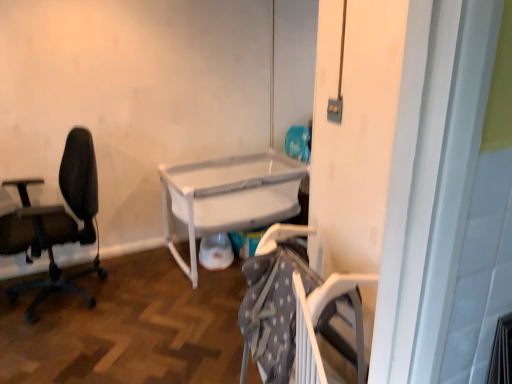
Question: Is white plastic crib at center at the back of black mesh office chair at left?

Choices:
 (A) no
 (B) yes

Answer: (B)

Question: From the image's perspective, would you say black mesh office chair at left is positioned over white plastic crib at center?

Choices:
 (A) no
 (B) yes

Answer: (A)

Question: Is black mesh office chair at left smaller than white plastic crib at center?

Choices:
 (A) no
 (B) yes

Answer: (B)

Question: Considering the relative positions of black mesh office chair at left and white plastic crib at center in the image provided, is black mesh office chair at left behind white plastic crib at center?

Choices:
 (A) yes
 (B) no

Answer: (B)

Question: Is black mesh office chair at left positioned far away from white plastic crib at center?

Choices:
 (A) yes
 (B) no

Answer: (B)

Question: In terms of width, does white plastic screen door at center look wider or thinner when compared to black mesh office chair at left?

Choices:
 (A) wide
 (B) thin

Answer: (B)

Question: Would you say white plastic screen door at center is inside or outside black mesh office chair at left?

Choices:
 (A) inside
 (B) outside

Answer: (B)

Question: From the image's perspective, is white plastic screen door at center above or below black mesh office chair at left?

Choices:
 (A) below
 (B) above

Answer: (A)

Question: In the image, is white plastic screen door at center positioned in front of or behind black mesh office chair at left?

Choices:
 (A) behind
 (B) front

Answer: (B)

Question: Is black mesh office chair at left in front of or behind white plastic crib at center in the image?

Choices:
 (A) behind
 (B) front

Answer: (B)

Question: Is black mesh office chair at left bigger or smaller than white plastic crib at center?

Choices:
 (A) big
 (B) small

Answer: (B)

Question: Is point (31, 311) closer or farther from the camera than point (228, 195)?

Choices:
 (A) farther
 (B) closer

Answer: (B)

Question: From the image's perspective, is black mesh office chair at left located above or below white plastic crib at center?

Choices:
 (A) above
 (B) below

Answer: (B)

Question: In the image, is white plastic screen door at center on the left side or the right side of white plastic crib at center?

Choices:
 (A) right
 (B) left

Answer: (A)

Question: Is white plastic screen door at center taller or shorter than white plastic crib at center?

Choices:
 (A) tall
 (B) short

Answer: (A)